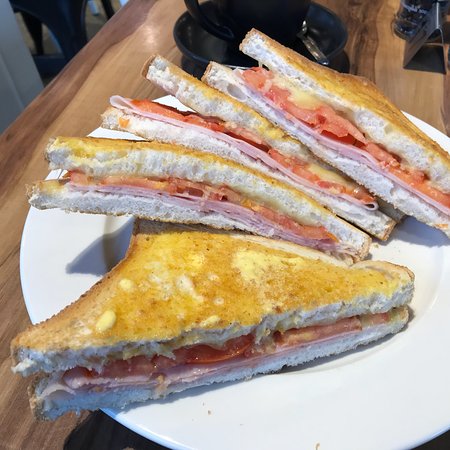
Where is `black teacup`? black teacup is located at coordinates (225, 27).